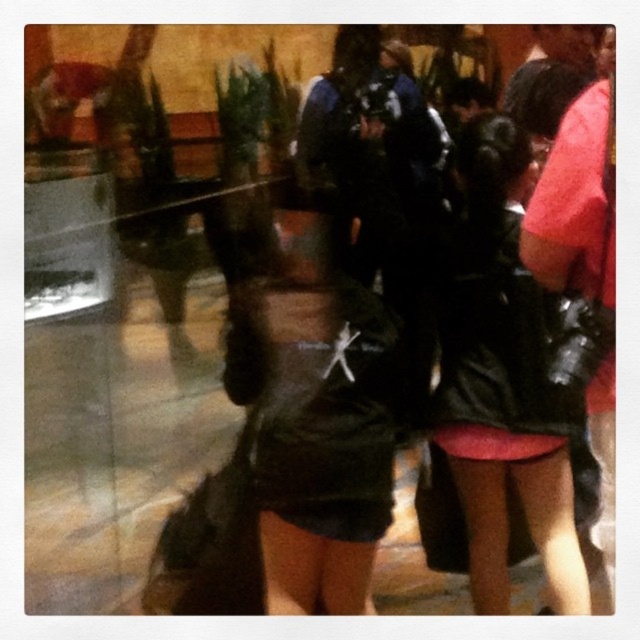
You are at an event and see two people dressed in dark colors. One is wearing a leather jacket at center and the other a black leather dress at right. Which one is more to the left?

The leather jacket at center is positioned on the right side of the black leather dress at right, so the black leather dress at right is more to the left.

You are a photographer trying to capture a clear shot of both the black leather jacket at center and the black leather dress at right without any overlap between them. Given the current distance between them, can you adjust your camera angle to ensure they are both in frame without overlapping?

The black leather jacket at center and black leather dress at right are 32.51 centimeters apart from each other. Since the distance between them is sufficient to allow framing without overlap, adjusting the camera angle appropriately should enable capturing both subjects clearly without overlap.